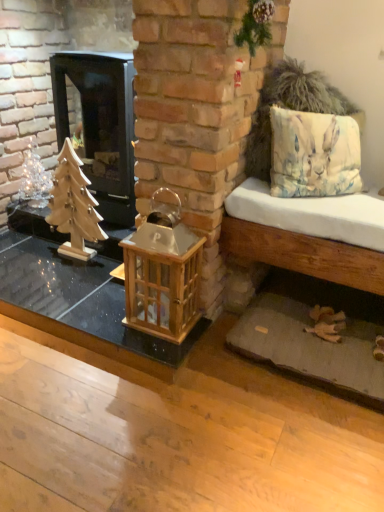
What is the approximate width of wooden lantern at center?

The width of wooden lantern at center is 8.34 inches.

What is the approximate width of black glass wood burning stove at left?

The width of black glass wood burning stove at left is 41.08 centimeters.

The height and width of the screenshot is (512, 384). Describe the element at coordinates (34, 178) in the screenshot. I see `shiny silver christmas tree at left` at that location.

At what (x,y) coordinates should I click in order to perform the action: click on wooden lantern at center. Please return your answer as a coordinate pair (x, y). Looking at the image, I should click on (163, 272).

Is shiny silver christmas tree at left behind wooden christmas tree at left?

Yes, shiny silver christmas tree at left is further from the viewer.

Looking at their sizes, would you say shiny silver christmas tree at left is wider or thinner than wooden christmas tree at left?

In the image, shiny silver christmas tree at left appears to be wider than wooden christmas tree at left.

Consider the image. Could wooden christmas tree at left be considered to be inside shiny silver christmas tree at left?

No, wooden christmas tree at left is not inside shiny silver christmas tree at left.

Who is shorter, wooden christmas tree at left or black glass wood burning stove at left?

wooden christmas tree at left.

Is wooden christmas tree at left placed right next to black glass wood burning stove at left?

No, wooden christmas tree at left is not in contact with black glass wood burning stove at left.

How many degrees apart are the facing directions of wooden christmas tree at left and black glass wood burning stove at left?

The angular difference between wooden christmas tree at left and black glass wood burning stove at left is 0.00131 degrees.

Considering the sizes of wooden christmas tree at left and black glass wood burning stove at left in the image, is wooden christmas tree at left bigger or smaller than black glass wood burning stove at left?

Considering their sizes, wooden christmas tree at left takes up less space than black glass wood burning stove at left.

Considering the relative sizes of black glass wood burning stove at left and watercolor fabric pillow at right in the image provided, is black glass wood burning stove at left taller than watercolor fabric pillow at right?

Answer: Yes, black glass wood burning stove at left is taller than watercolor fabric pillow at right.

From the picture: Which of these two, black glass wood burning stove at left or watercolor fabric pillow at right, is smaller?

watercolor fabric pillow at right is smaller.

From the image's perspective, does black glass wood burning stove at left appear lower than watercolor fabric pillow at right?

Actually, black glass wood burning stove at left appears above watercolor fabric pillow at right in the image.

How much distance is there between black glass wood burning stove at left and watercolor fabric pillow at right?

black glass wood burning stove at left is 32.04 inches away from watercolor fabric pillow at right.

Is watercolor fabric pillow at right positioned beyond the bounds of wooden lantern at center?

That's correct, watercolor fabric pillow at right is outside of wooden lantern at center.

Does watercolor fabric pillow at right have a greater height compared to wooden lantern at center?

In fact, watercolor fabric pillow at right may be shorter than wooden lantern at center.

From a real-world perspective, between watercolor fabric pillow at right and wooden lantern at center, who is vertically higher?

From a 3D spatial view, watercolor fabric pillow at right is above.

From a real-world perspective, is wooden lantern at center on top of watercolor fabric pillow at right?

No.

Is wooden lantern at center looking in the opposite direction of watercolor fabric pillow at right?

That's not correct — wooden lantern at center is not looking away from watercolor fabric pillow at right.

From the image's perspective, which one is positioned lower, wooden lantern at center or watercolor fabric pillow at right?

wooden lantern at center is shown below in the image.

Can you tell me how much wooden lantern at center and watercolor fabric pillow at right differ in facing direction?

wooden lantern at center and watercolor fabric pillow at right are facing 45.8 degrees away from each other.

Is wooden table at center situated inside wooden lantern at center or outside?

The correct answer is: outside.

From a real-world perspective, who is located higher, wooden table at center or wooden lantern at center?

wooden lantern at center, from a real-world perspective.

From their relative heights in the image, would you say wooden table at center is taller or shorter than wooden lantern at center?

Clearly, wooden table at center is shorter compared to wooden lantern at center.

Considering their positions, is wooden table at center located in front of or behind wooden lantern at center?

In the image, wooden table at center appears behind wooden lantern at center.

Can you confirm if wooden christmas tree at left is shorter than watercolor fabric pillow at right?

Incorrect, the height of wooden christmas tree at left does not fall short of that of watercolor fabric pillow at right.

From the image's perspective, is wooden christmas tree at left over watercolor fabric pillow at right?

No, from the image's perspective, wooden christmas tree at left is not over watercolor fabric pillow at right.

Does wooden christmas tree at left have a smaller size compared to watercolor fabric pillow at right?

Yes.

Are wooden christmas tree at left and watercolor fabric pillow at right making contact?

wooden christmas tree at left is not next to watercolor fabric pillow at right, and they're not touching.

Locate an element on the screen. christmas decoration above the wooden christmas tree at left (from a real-world perspective) is located at coordinates (34, 178).

Image resolution: width=384 pixels, height=512 pixels. I want to click on wood burning stove above the wooden christmas tree at left (from the image's perspective), so click(100, 126).

Based on their spatial positions, is black glass wood burning stove at left or shiny silver christmas tree at left further from wooden christmas tree at left?

Among the two, shiny silver christmas tree at left is located further to wooden christmas tree at left.

Based on their spatial positions, is shiny silver christmas tree at left or wooden christmas tree at left closer to light brown wooden bench at right?

Based on the image, wooden christmas tree at left appears to be nearer to light brown wooden bench at right.

Based on their spatial positions, is watercolor fabric pillow at right or wooden lantern at center further from light brown wooden bench at right?

wooden lantern at center is further to light brown wooden bench at right.

When comparing their distances from shiny silver christmas tree at left, does light brown wooden bench at right or black glass wood burning stove at left seem closer?

black glass wood burning stove at left is positioned closer to the anchor shiny silver christmas tree at left.

Based on the photo, when comparing their distances from wooden lantern at center, does watercolor fabric pillow at right or black glass wood burning stove at left seem closer?

watercolor fabric pillow at right is closer to wooden lantern at center.

When comparing their distances from wooden table at center, does wooden christmas tree at left or watercolor fabric pillow at right seem further?

Among the two, watercolor fabric pillow at right is located further to wooden table at center.

Based on their spatial positions, is black glass wood burning stove at left or wooden table at center closer to watercolor fabric pillow at right?

black glass wood burning stove at left is positioned closer to the anchor watercolor fabric pillow at right.

When comparing their distances from wooden lantern at center, does wooden christmas tree at left or shiny silver christmas tree at left seem further?

Based on the image, shiny silver christmas tree at left appears to be further to wooden lantern at center.

This screenshot has height=512, width=384. In order to click on christmas tree between wooden table at center and watercolor fabric pillow at right in the horizontal direction in this screenshot , I will do `click(74, 206)`.

Where is `bird cage between wooden table at center and light brown wooden bench at right`? bird cage between wooden table at center and light brown wooden bench at right is located at coordinates (163, 272).

Where is `bird cage between shiny silver christmas tree at left and light brown wooden bench at right`? The image size is (384, 512). bird cage between shiny silver christmas tree at left and light brown wooden bench at right is located at coordinates (163, 272).

The width and height of the screenshot is (384, 512). I want to click on christmas tree between shiny silver christmas tree at left and watercolor fabric pillow at right from left to right, so click(x=74, y=206).